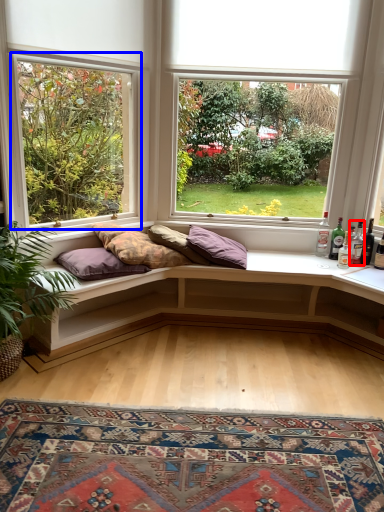
Question: Which of the following is the closest to the observer, bottle (highlighted by a red box) or window (highlighted by a blue box)?

Choices:
 (A) bottle
 (B) window

Answer: (B)